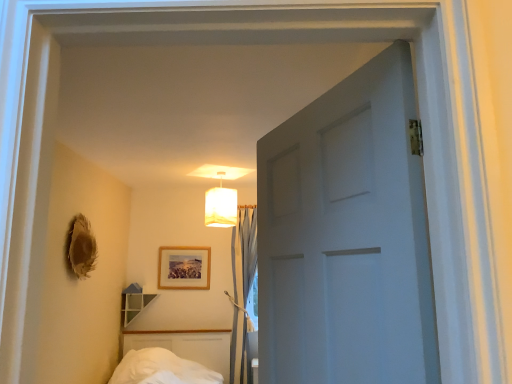
Question: Should I look upward or downward to see wooden picture frame at center?

Choices:
 (A) up
 (B) down

Answer: (B)

Question: Is wooden picture frame at center oriented towards white fabric lampshade at upper center?

Choices:
 (A) no
 (B) yes

Answer: (A)

Question: Does wooden picture frame at center have a lesser height compared to white fabric lampshade at upper center?

Choices:
 (A) no
 (B) yes

Answer: (B)

Question: From a real-world perspective, is wooden picture frame at center below white fabric lampshade at upper center?

Choices:
 (A) no
 (B) yes

Answer: (B)

Question: Is wooden picture frame at center to the left of white fabric lampshade at upper center from the viewer's perspective?

Choices:
 (A) yes
 (B) no

Answer: (A)

Question: Is white fabric lampshade at upper center a part of wooden picture frame at center?

Choices:
 (A) yes
 (B) no

Answer: (B)

Question: Does wooden picture frame at center have a lesser width compared to white fabric lampshade at upper center?

Choices:
 (A) yes
 (B) no

Answer: (A)

Question: Can you confirm if white fabric lampshade at upper center is positioned to the right of light blue fabric curtain at center?

Choices:
 (A) no
 (B) yes

Answer: (A)

Question: Considering the relative sizes of white fabric lampshade at upper center and light blue fabric curtain at center in the image provided, is white fabric lampshade at upper center bigger than light blue fabric curtain at center?

Choices:
 (A) yes
 (B) no

Answer: (B)

Question: Is the depth of white fabric lampshade at upper center greater than that of light blue fabric curtain at center?

Choices:
 (A) no
 (B) yes

Answer: (A)

Question: Can you confirm if white fabric lampshade at upper center is smaller than light blue fabric curtain at center?

Choices:
 (A) no
 (B) yes

Answer: (B)

Question: From a real-world perspective, is white fabric lampshade at upper center under light blue fabric curtain at center?

Choices:
 (A) yes
 (B) no

Answer: (B)

Question: Is white fabric lampshade at upper center to the left of light blue fabric curtain at center from the viewer's perspective?

Choices:
 (A) no
 (B) yes

Answer: (B)

Question: Does light blue fabric curtain at center have a greater width compared to white fabric lampshade at upper center?

Choices:
 (A) yes
 (B) no

Answer: (B)